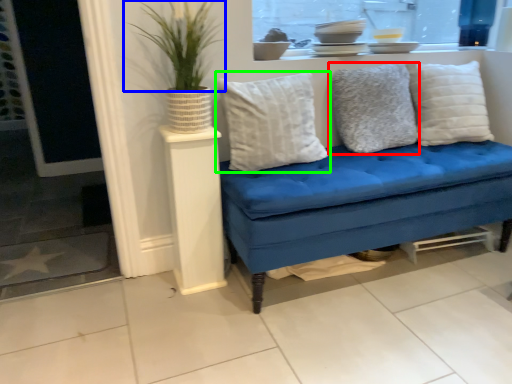
Question: Which is farther away from pillow (highlighted by a red box)? plant (highlighted by a blue box) or pillow (highlighted by a green box)?

Choices:
 (A) plant
 (B) pillow

Answer: (A)